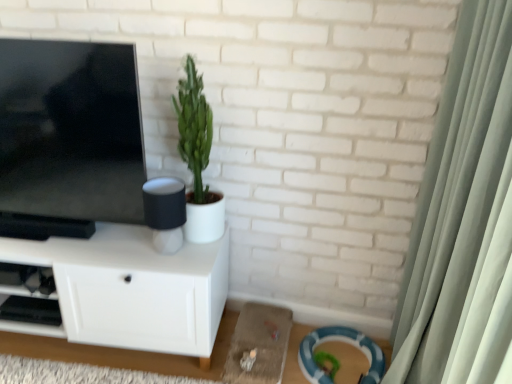
The height and width of the screenshot is (384, 512). What are the coordinates of `free space in front of matte black speaker at center` in the screenshot? It's located at (157, 266).